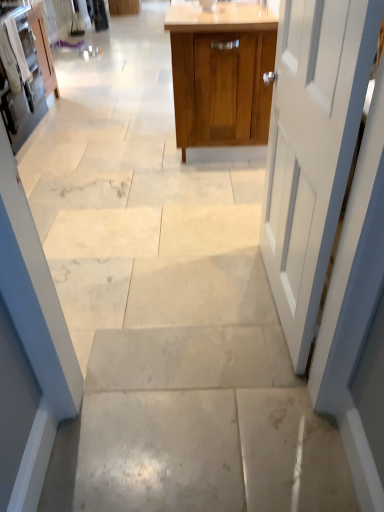
Where is `vacant space to the left of white painted wood door at right`? The image size is (384, 512). vacant space to the left of white painted wood door at right is located at coordinates (183, 296).